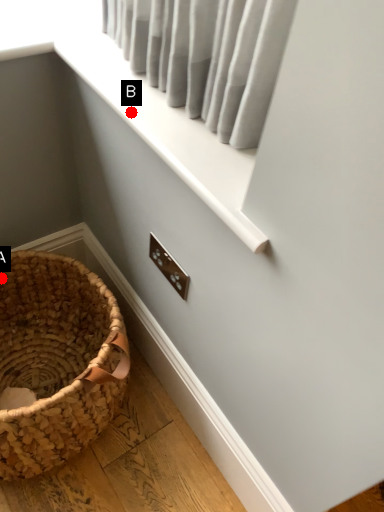
Question: Two points are circled on the image, labeled by A and B beside each circle. Which point is farther from the camera taking this photo?

Choices:
 (A) A is further
 (B) B is further

Answer: (A)